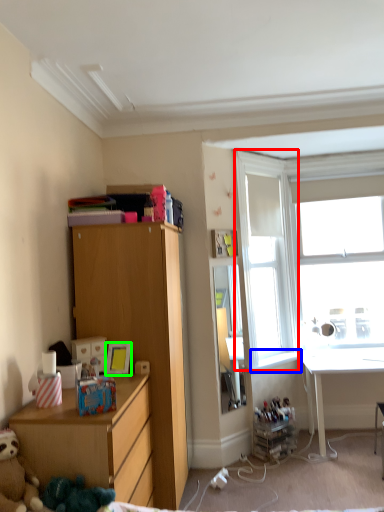
Question: Based on their relative distances, which object is nearer to window screen (highlighted by a red box)? Choose from window sill (highlighted by a blue box) and picture frame (highlighted by a green box).

Choices:
 (A) window sill
 (B) picture frame

Answer: (A)